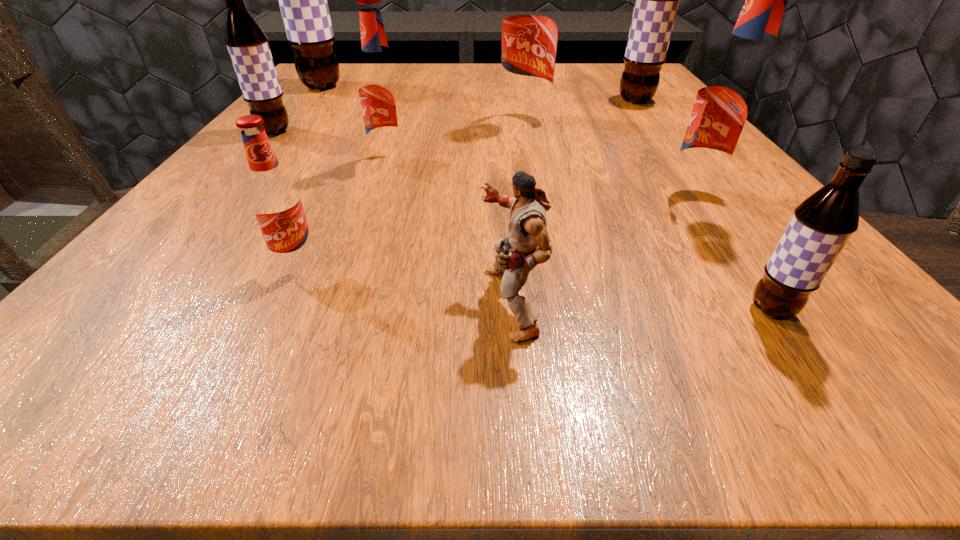
In the image, there is a desktop. Where is `vacant space at the far edge`? This screenshot has height=540, width=960. vacant space at the far edge is located at coordinates (470, 73).

Image resolution: width=960 pixels, height=540 pixels. In order to click on vacant space at the near edge in this screenshot , I will do `click(738, 354)`.

Identify the location of vacant space at the left edge. This screenshot has height=540, width=960. (295, 98).

Find the location of a particular element. vacant space at the right edge of the desktop is located at coordinates (618, 100).

In the image, there is a desktop. Where is `blank space at the near left corner`? Image resolution: width=960 pixels, height=540 pixels. blank space at the near left corner is located at coordinates (218, 338).

At what (x,y) coordinates should I click in order to perform the action: click on vacant area at the near right corner of the desktop. Please return your answer as a coordinate pair (x, y). Image resolution: width=960 pixels, height=540 pixels. Looking at the image, I should click on (879, 330).

The height and width of the screenshot is (540, 960). I want to click on free space between the leftmost red root beer and the third nearest root beer, so click(x=497, y=231).

This screenshot has height=540, width=960. Find the location of `vacant point located between the smallest red root beer and the third nearest red root beer`. vacant point located between the smallest red root beer and the third nearest red root beer is located at coordinates (344, 213).

The image size is (960, 540). Identify the location of free spot between the second nearest root beer and the puncher. (404, 283).

Where is `vacant space in between the third biggest brown root beer and the puncher`? This screenshot has width=960, height=540. vacant space in between the third biggest brown root beer and the puncher is located at coordinates (393, 217).